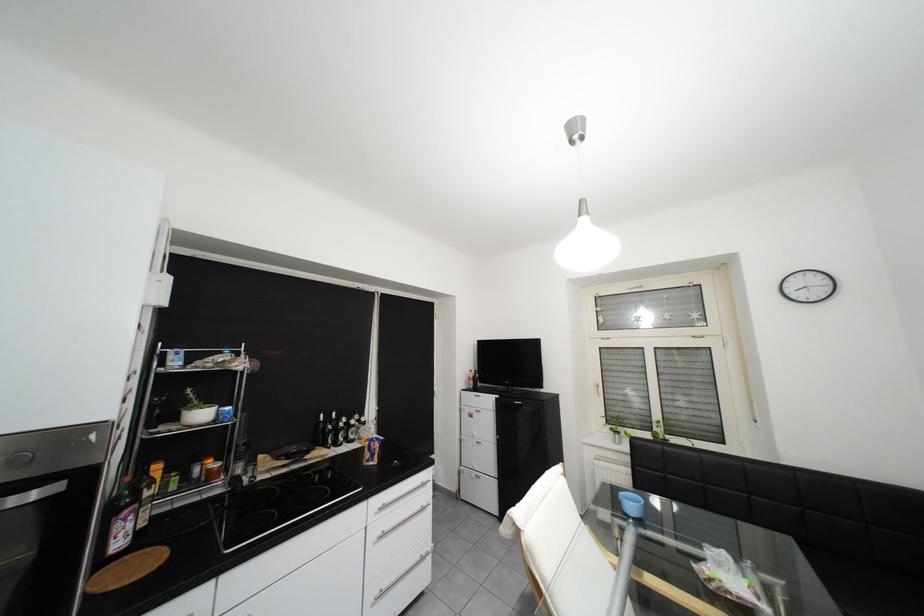
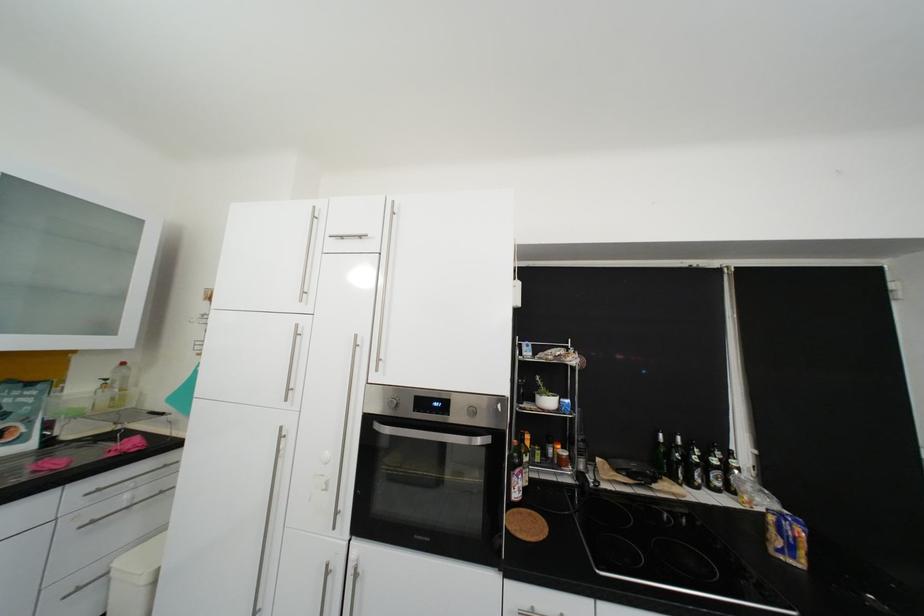
The point at (337,428) is marked in the first image. Where is the corresponding point in the second image?

(682, 454)